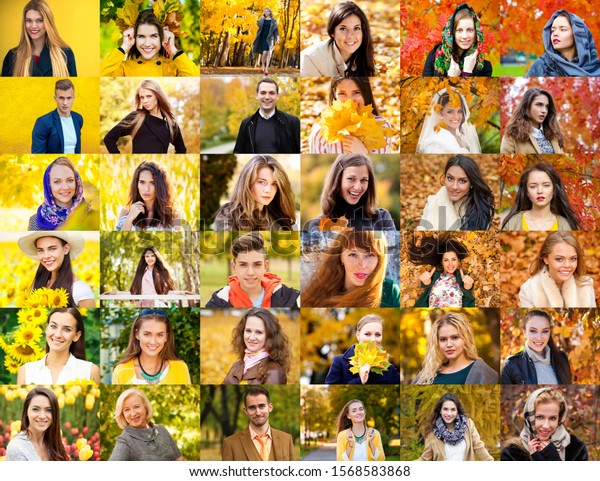
Where is `individual pictures on the second row from the top`? individual pictures on the second row from the top is located at coordinates (60, 122), (151, 128), (261, 129), (354, 87), (448, 118), (537, 130).